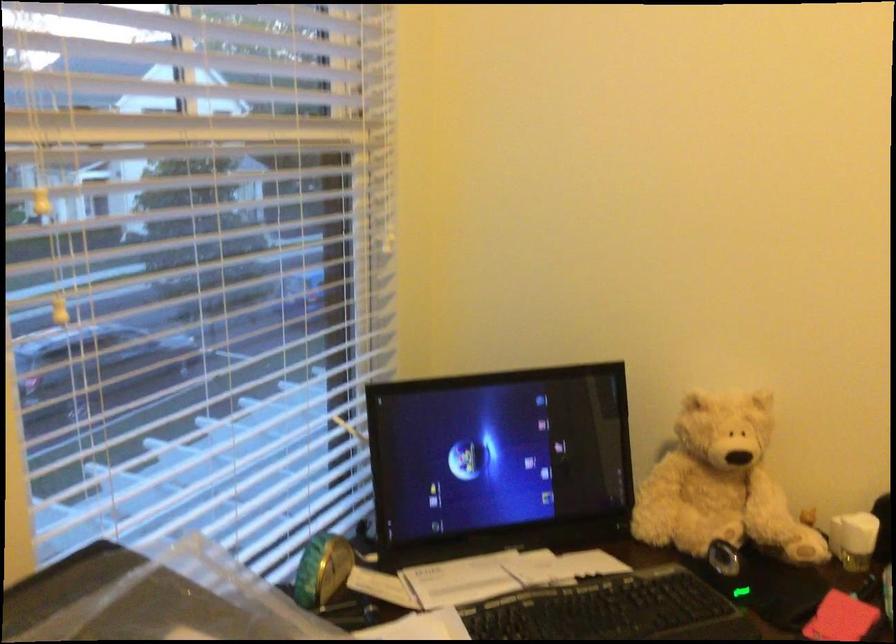
Find where to slid the computer mouse. Please return your answer as a coordinate pair (x, y).

(722, 558)